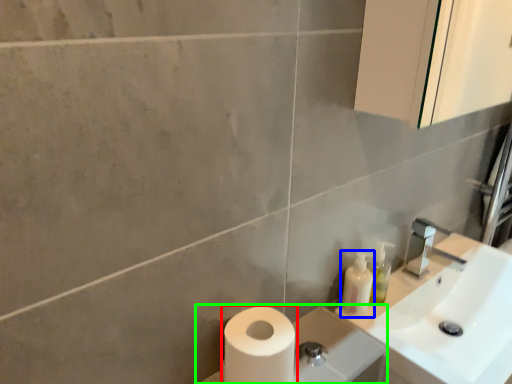
Question: Which object is positioned farthest from toilet paper (highlighted by a red box)? Select from toiletry (highlighted by a blue box) and porcelain (highlighted by a green box).

Choices:
 (A) toiletry
 (B) porcelain

Answer: (A)